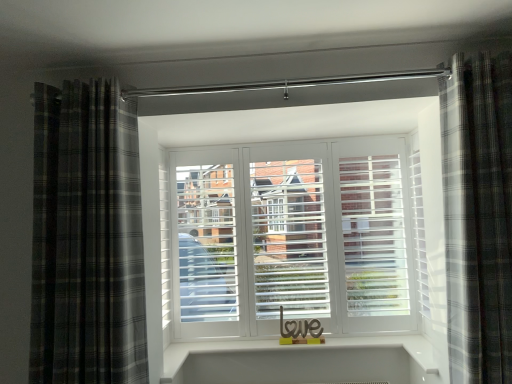
Question: From a real-world perspective, is plaid fabric curtain at right, which appears as the first curtain when viewed from the right, positioned above or below plaid fabric curtain at left, placed as the first curtain when sorted from left to right?

Choices:
 (A) below
 (B) above

Answer: (A)

Question: Is plaid fabric curtain at right, which appears as the first curtain when viewed from the right, situated inside plaid fabric curtain at left, placed as the first curtain when sorted from left to right, or outside?

Choices:
 (A) outside
 (B) inside

Answer: (A)

Question: In terms of size, does plaid fabric curtain at right, which appears as the first curtain when viewed from the right, appear bigger or smaller than plaid fabric curtain at left, placed as the first curtain when sorted from left to right?

Choices:
 (A) big
 (B) small

Answer: (B)

Question: Is plaid fabric curtain at left, marked as the second curtain in a right-to-left arrangement, taller or shorter than plaid fabric curtain at right, which appears as the first curtain when viewed from the right?

Choices:
 (A) tall
 (B) short

Answer: (B)

Question: Is plaid fabric curtain at left, placed as the first curtain when sorted from left to right, situated inside plaid fabric curtain at right, which appears as the first curtain when viewed from the right, or outside?

Choices:
 (A) outside
 (B) inside

Answer: (A)

Question: Visually, is plaid fabric curtain at left, placed as the first curtain when sorted from left to right, positioned to the left or to the right of plaid fabric curtain at right, marked as the 2th curtain in a left-to-right arrangement?

Choices:
 (A) left
 (B) right

Answer: (A)

Question: From the image's perspective, is plaid fabric curtain at left, marked as the second curtain in a right-to-left arrangement, positioned above or below plaid fabric curtain at right, marked as the 2th curtain in a left-to-right arrangement?

Choices:
 (A) above
 (B) below

Answer: (B)